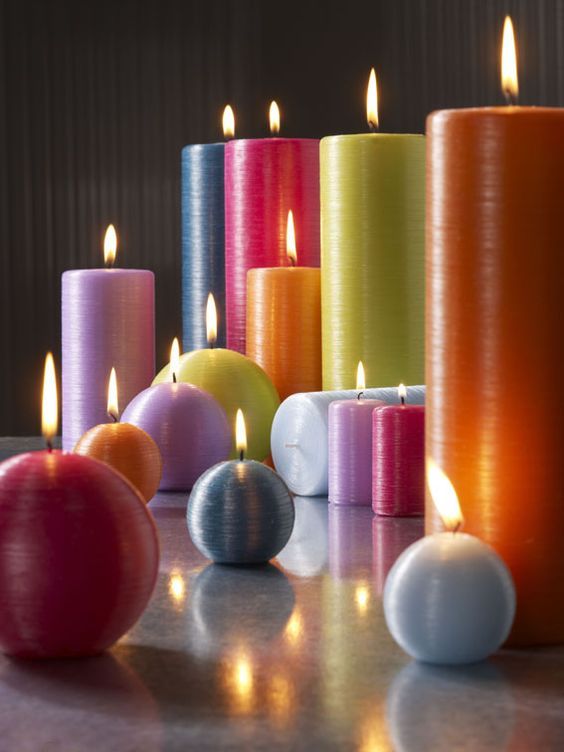
Identify the location of cylindrical candles. This screenshot has width=564, height=752. (110, 320), (193, 265), (237, 235), (276, 308), (358, 293), (469, 329), (306, 435), (352, 447), (400, 462).